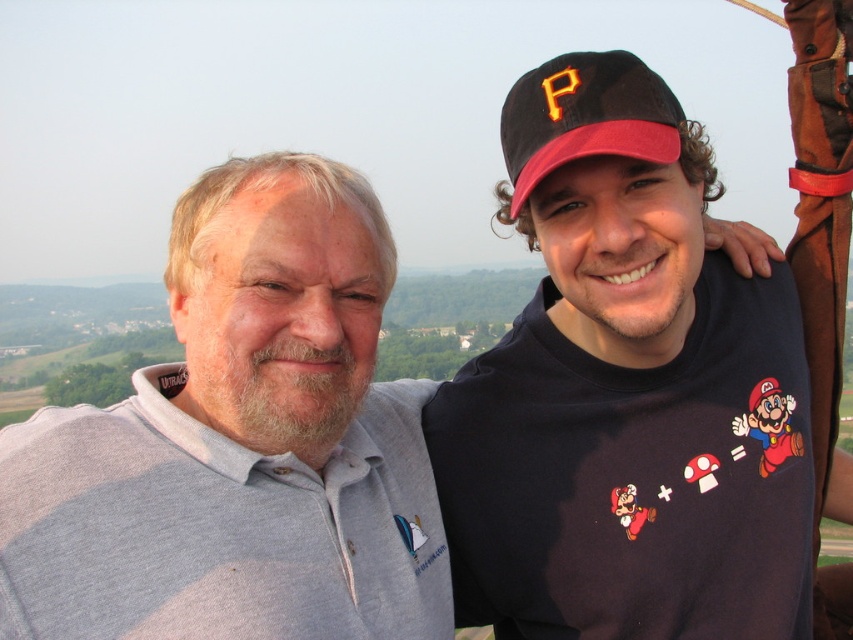
Question: Is black matte cap at upper right wider than gray cotton shirt at upper left?

Choices:
 (A) yes
 (B) no

Answer: (B)

Question: Which point is farther to the camera?

Choices:
 (A) black matte cap at upper right
 (B) black fabric baseball cap at upper right

Answer: (B)

Question: Does black matte cap at upper right have a smaller size compared to black fabric baseball cap at upper right?

Choices:
 (A) yes
 (B) no

Answer: (B)

Question: Based on their relative distances, which object is farther from the black matte cap at upper right?

Choices:
 (A) black fabric baseball cap at upper right
 (B) gray cotton shirt at upper left

Answer: (B)

Question: Does gray cotton shirt at upper left appear on the left side of black fabric baseball cap at upper right?

Choices:
 (A) yes
 (B) no

Answer: (A)

Question: Which of the following is the farthest from the observer?

Choices:
 (A) (219, 224)
 (B) (523, 172)
 (C) (573, 195)

Answer: (C)